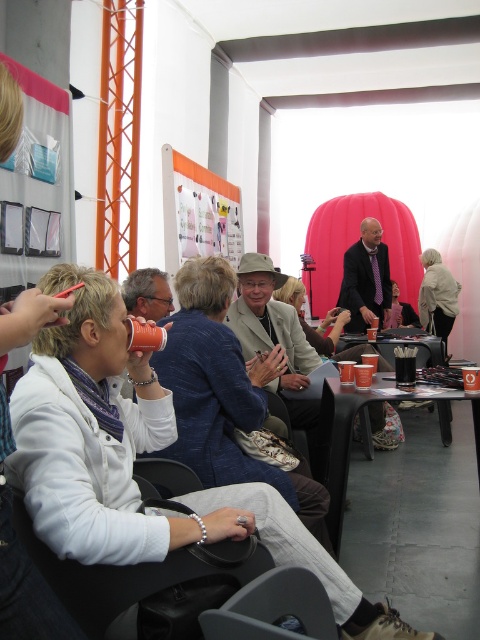
Does formal suit at center have a larger size compared to matte black jacket at center?

No, formal suit at center is not bigger than matte black jacket at center.

Where is `formal suit at center`? formal suit at center is located at coordinates (365, 278).

Is point (381, 276) less distant than point (395, 323)?

Yes, it is in front of point (395, 323).

Identify the location of formal suit at center. (365, 278).

Between matte plastic cup at center and black plastic cup at center, which one has more height?

With more height is black plastic cup at center.

Is matte plastic cup at center shorter than black plastic cup at center?

Indeed, matte plastic cup at center has a lesser height compared to black plastic cup at center.

Does point (134, 332) lie behind point (395, 364)?

No, (134, 332) is in front of (395, 364).

The height and width of the screenshot is (640, 480). Identify the location of matte plastic cup at center. (144, 336).

Measure the distance between point (349,310) and camera.

Point (349,310) and camera are 5.37 meters apart.

Can you confirm if formal suit at center is wider than matte plastic cup at center?

Indeed, formal suit at center has a greater width compared to matte plastic cup at center.

Is point (367, 289) closer to viewer compared to point (164, 339)?

No, it is behind (164, 339).

Where is `formal suit at center`? This screenshot has width=480, height=640. formal suit at center is located at coordinates (365, 278).